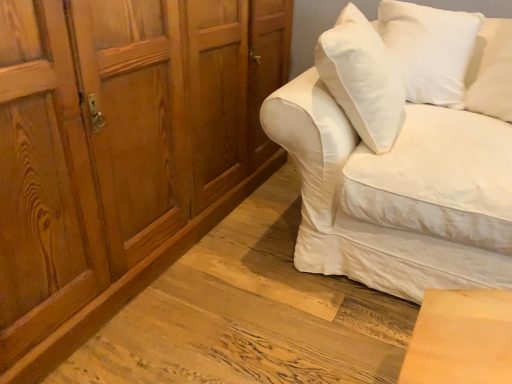
Question: Considering the positions of wooden cabinet at left and white cotton couch at right in the image, is wooden cabinet at left bigger or smaller than white cotton couch at right?

Choices:
 (A) small
 (B) big

Answer: (B)

Question: Is wooden cabinet at left wider or thinner than white cotton couch at right?

Choices:
 (A) wide
 (B) thin

Answer: (B)

Question: Which of these objects is positioned farthest from the white cotton couch at right?

Choices:
 (A) wooden cabinet at left
 (B) white soft cushion at upper right

Answer: (A)

Question: Based on their relative distances, which object is farther from the white soft cushion at upper right?

Choices:
 (A) wooden cabinet at left
 (B) white cotton couch at right

Answer: (A)